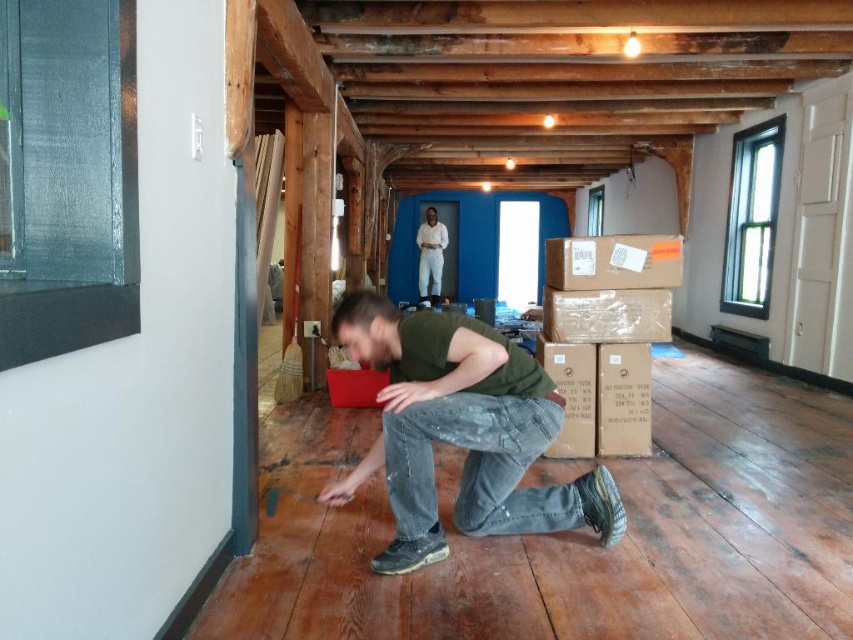
Question: Is matte green shirt at center wider than matte brown cardboard box at right?

Choices:
 (A) yes
 (B) no

Answer: (A)

Question: Which object appears farthest from the camera in this image?

Choices:
 (A) green cotton shirt at center
 (B) matte brown cardboard box at center
 (C) white cotton shirt at center
 (D) matte green shirt at center

Answer: (C)

Question: Among these points, which one is farthest from the camera?

Choices:
 (A) (630, 291)
 (B) (514, 420)

Answer: (A)

Question: Based on their relative distances, which object is farther from the matte brown cardboard box at center?

Choices:
 (A) white cotton shirt at center
 (B) green cotton shirt at center

Answer: (A)

Question: Is the position of green cotton shirt at center more distant than that of matte brown cardboard box at right?

Choices:
 (A) yes
 (B) no

Answer: (B)

Question: Does matte green shirt at center lie in front of green cotton shirt at center?

Choices:
 (A) no
 (B) yes

Answer: (B)